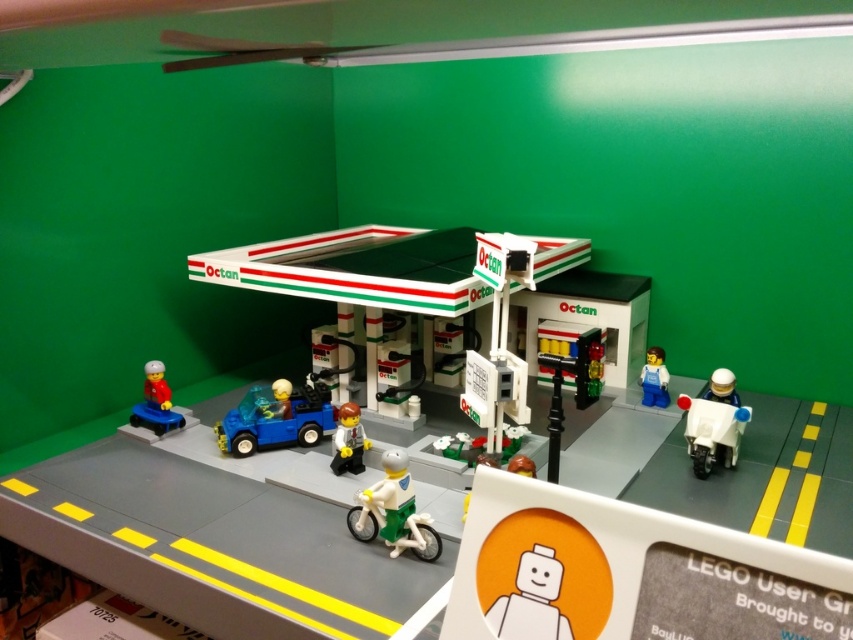
Does translucent blue car at center appear on the left side of matte red minifigure at left?

In fact, translucent blue car at center is to the right of matte red minifigure at left.

Which is more to the left, translucent blue car at center or matte red minifigure at left?

Positioned to the left is matte red minifigure at left.

What do you see at coordinates (276, 417) in the screenshot?
I see `translucent blue car at center` at bounding box center [276, 417].

Locate an element on the screen. translucent blue car at center is located at coordinates (276, 417).

Is matte red minifigure at left below smooth white minifigure at center?

Actually, matte red minifigure at left is above smooth white minifigure at center.

Describe the element at coordinates (155, 403) in the screenshot. I see `matte red minifigure at left` at that location.

Where is `matte red minifigure at left`? This screenshot has height=640, width=853. matte red minifigure at left is located at coordinates (155, 403).

Does translucent blue car at center come behind white matte minifigure at center?

Yes, it is behind white matte minifigure at center.

Is translucent blue car at center bigger than white matte minifigure at center?

Correct, translucent blue car at center is larger in size than white matte minifigure at center.

Is point (257, 422) in front of point (560, 572)?

No, (257, 422) is behind (560, 572).

Where is `translucent blue car at center`? The width and height of the screenshot is (853, 640). translucent blue car at center is located at coordinates (276, 417).